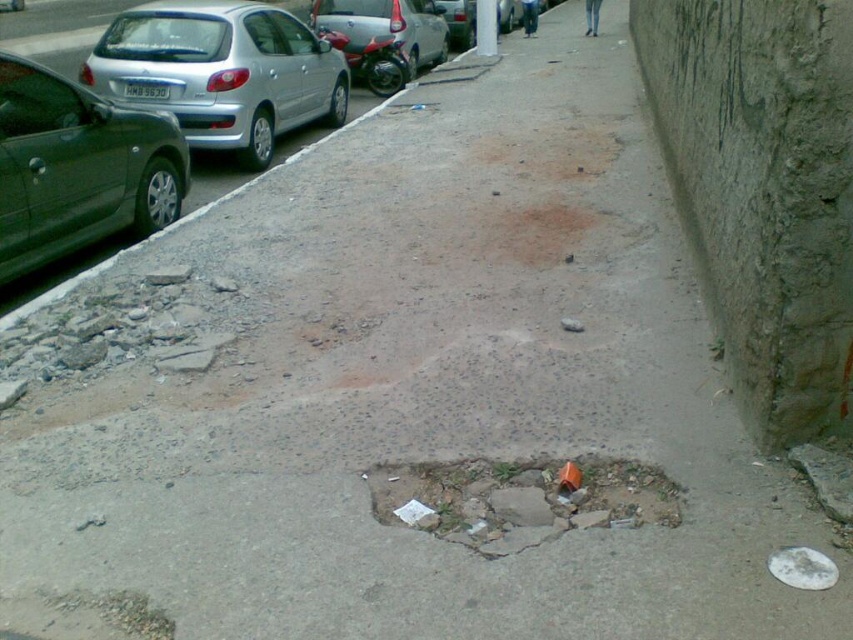
Question: Which of the following is the closest to the observer?

Choices:
 (A) [125, 64]
 (B) [86, 218]
 (C) [352, 12]

Answer: (B)

Question: Is silver metallic hatchback at left to the left of metallic green car at left from the viewer's perspective?

Choices:
 (A) yes
 (B) no

Answer: (B)

Question: Can you confirm if silver metallic hatchback at left is bigger than silver metallic car at upper left?

Choices:
 (A) no
 (B) yes

Answer: (B)

Question: Is metallic green car at left to the right of silver metallic car at upper left from the viewer's perspective?

Choices:
 (A) no
 (B) yes

Answer: (A)

Question: Which of these objects is positioned closest to the silver metallic car at upper left?

Choices:
 (A) cracked concrete hole at center
 (B) silver metallic hatchback at left
 (C) metallic green car at left

Answer: (B)

Question: Which object appears closest to the camera in this image?

Choices:
 (A) silver metallic car at upper left
 (B) silver metallic hatchback at left

Answer: (B)